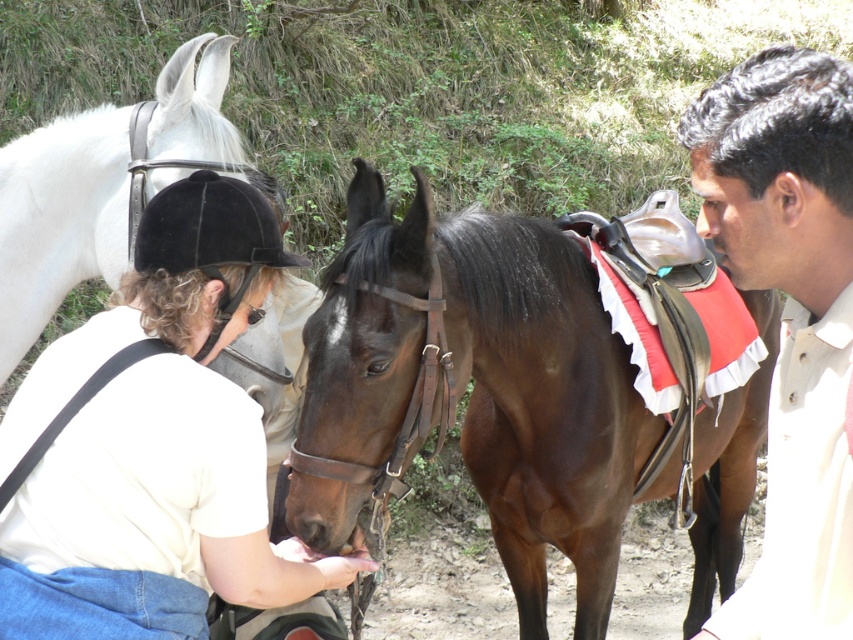
What is the color of the shirt located at the point marked by the coordinates [788,317]?

The color of the shirt located at the point marked by the coordinates [788,317] is beige.

Based on the photo, you are a photographer trying to capture a clear shot of the brown leather horse at center and the white matte helmet at upper left. Which object should you focus on first to ensure it appears sharp in the photo?

The brown leather horse at center is closer to the viewer than the white matte helmet at upper left, so you should focus on the brown leather horse at center first to ensure it appears sharp.